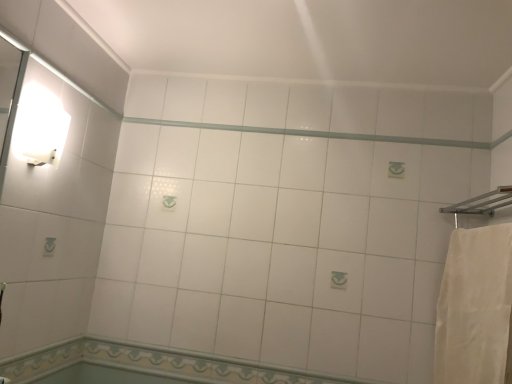
Question: Relative to white cotton bath towel at right, is white glossy beam at center in front or behind?

Choices:
 (A) front
 (B) behind

Answer: (B)

Question: From the image's perspective, is white glossy beam at center located above or below white cotton bath towel at right?

Choices:
 (A) above
 (B) below

Answer: (A)

Question: Estimate the real-world distances between objects in this image. Which object is closer to the white cotton bath towel at right?

Choices:
 (A) white glossy beam at center
 (B) white glossy wall sconce at upper left
 (C) decorative tile border at lower center, the 1th bath from the bottom
 (D) white glossy tile at lower center, arranged as the 1th bath when viewed from the top

Answer: (D)

Question: Which is nearer to the white glossy wall sconce at upper left?

Choices:
 (A) white cotton bath towel at right
 (B) white glossy beam at center
 (C) white glossy tile at lower center, the 2th bath ordered from the bottom
 (D) decorative tile border at lower center, which is the 2th bath in top-to-bottom order

Answer: (B)